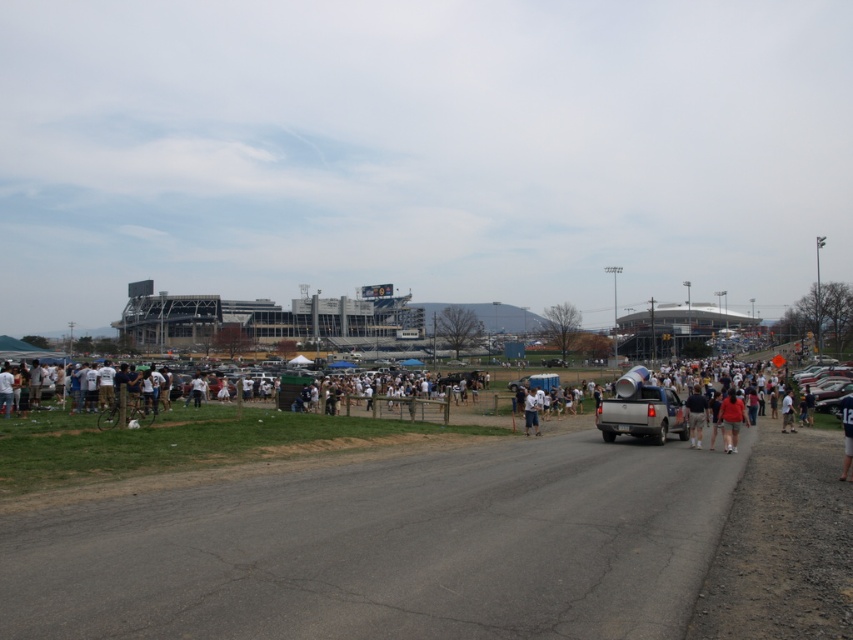
Describe the element at coordinates (642, 413) in the screenshot. The width and height of the screenshot is (853, 640). I see `silver metallic truck at center-right` at that location.

Is silver metallic truck at center-right in front of matte red shirt at center?

That is False.

What do you see at coordinates (642, 413) in the screenshot? I see `silver metallic truck at center-right` at bounding box center [642, 413].

I want to click on silver metallic truck at center-right, so click(642, 413).

Is brown dirt track at center thinner than white cotton shirt at center?

No.

Does point (241, 604) come in front of point (527, 416)?

That is True.

Is point (514, 620) farther from viewer compared to point (527, 429)?

No.

You are a GUI agent. You are given a task and a screenshot of the screen. Output one action in this format:
    pyautogui.click(x=<x>, y=<y>)
    Task: Click on the brown dirt track at center
    The image size is (853, 640).
    Given the screenshot: What is the action you would take?
    tap(386, 548)

Can you confirm if tan fabric shirt at center is positioned below blue jersey at center?

Yes, tan fabric shirt at center is below blue jersey at center.

Can you confirm if tan fabric shirt at center is shorter than blue jersey at center?

Yes, tan fabric shirt at center is shorter than blue jersey at center.

Locate an element on the screen. tan fabric shirt at center is located at coordinates (695, 416).

Identify the location of tan fabric shirt at center. (695, 416).